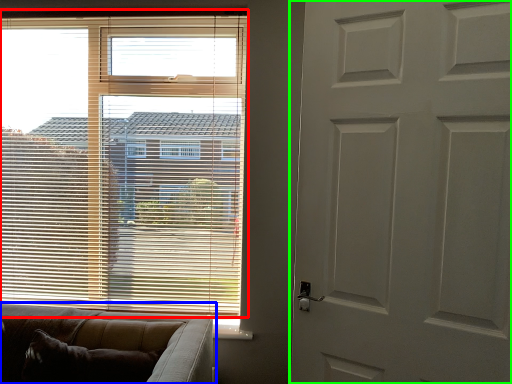
Question: Which object is the closest to the window blind (highlighted by a red box)? Choose among these: studio couch (highlighted by a blue box) or door (highlighted by a green box).

Choices:
 (A) studio couch
 (B) door

Answer: (A)